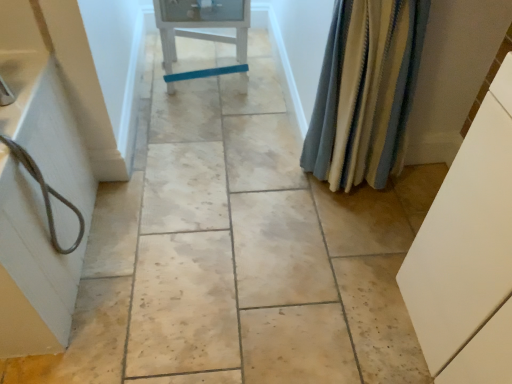
This screenshot has height=384, width=512. In order to click on vacant space in front of striped fabric shower curtain at right in this screenshot , I will do `click(344, 239)`.